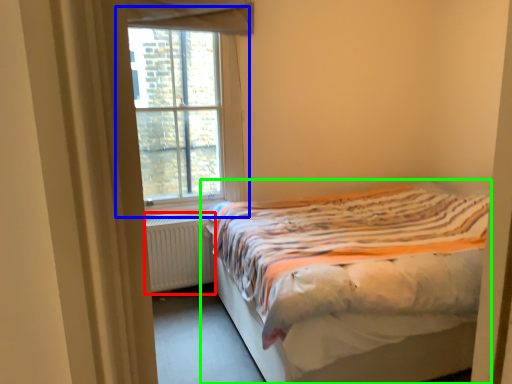
Question: Considering the real-world distances, which object is farthest from radiator (highlighted by a red box)? window (highlighted by a blue box) or bed (highlighted by a green box)?

Choices:
 (A) window
 (B) bed

Answer: (B)